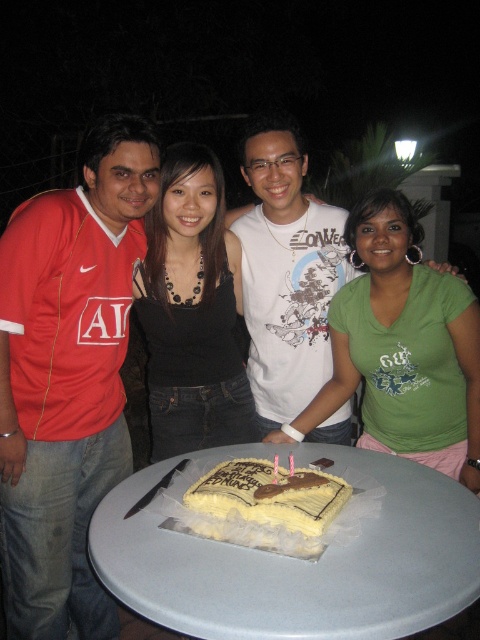
You are at a birthday party and need to place a gift on the table. Which object should you approach first, the white plastic table at center or the yellow frosted rectangular cake at center?

The white plastic table at center is in front of the yellow frosted rectangular cake at center, so you should approach the white plastic table at center first to place the gift.